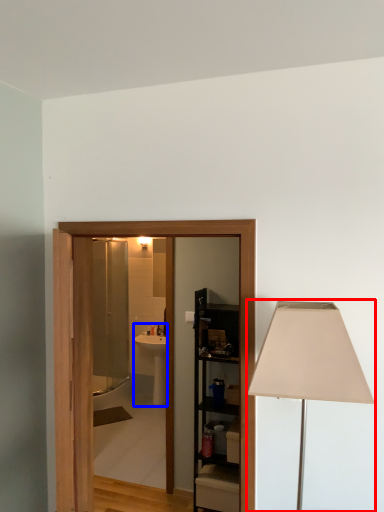
Question: Which object is further to the camera taking this photo, lamp (highlighted by a red box) or sink (highlighted by a blue box)?

Choices:
 (A) lamp
 (B) sink

Answer: (B)